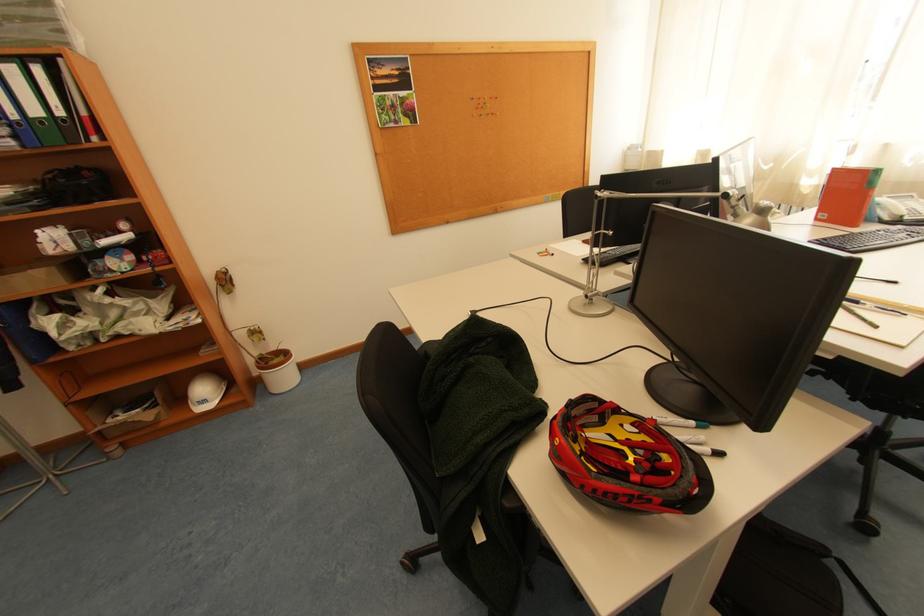
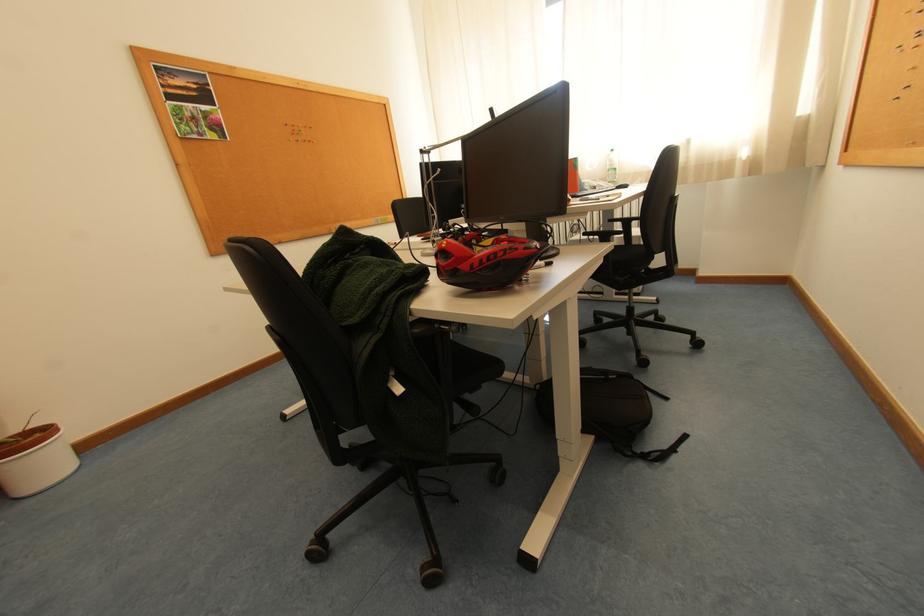
Question: The images are taken continuously from a first-person perspective. In which direction is your viewpoint rotating?

Choices:
 (A) Left
 (B) Right
 (C) Up
 (D) Down

Answer: (B)